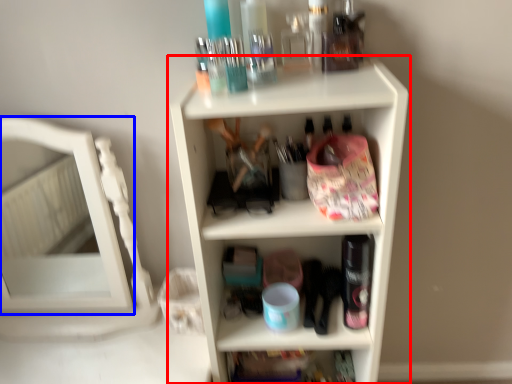
Question: Which point is closer to the camera, shelf (highlighted by a red box) or mirror (highlighted by a blue box)?

Choices:
 (A) shelf
 (B) mirror

Answer: (A)